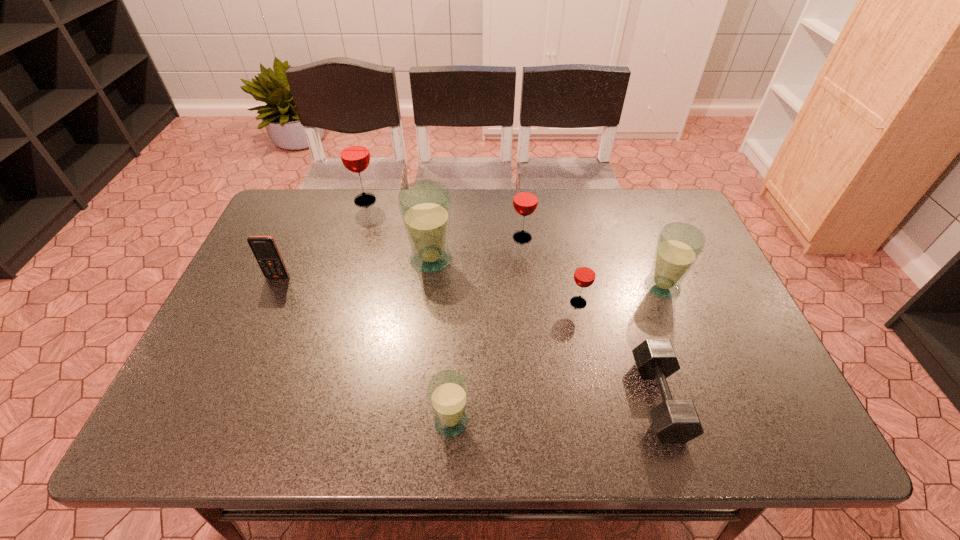
The width and height of the screenshot is (960, 540). What are the coordinates of `the fifth glass from left to right` in the screenshot? It's located at (584, 276).

The width and height of the screenshot is (960, 540). What are the coordinates of `the smallest blue glass` in the screenshot? It's located at (448, 391).

You are a GUI agent. You are given a task and a screenshot of the screen. Output one action in this format:
    pyautogui.click(x=<x>, y=<y>)
    Task: Click on the nearest blue glass
    The width and height of the screenshot is (960, 540).
    Given the screenshot: What is the action you would take?
    pyautogui.click(x=448, y=391)

Where is `the second object from right to left`? This screenshot has width=960, height=540. the second object from right to left is located at coordinates (674, 421).

Find the location of `dumbbell`. dumbbell is located at coordinates (674, 421).

Where is `vacant space located 0.140m on the right of the leftmost red glass`? vacant space located 0.140m on the right of the leftmost red glass is located at coordinates (421, 200).

Where is `free point located on the front of the biggest blue glass`? free point located on the front of the biggest blue glass is located at coordinates (415, 409).

Where is `vacant space located on the left of the rightmost object`? Image resolution: width=960 pixels, height=540 pixels. vacant space located on the left of the rightmost object is located at coordinates (564, 287).

What are the coordinates of `vacant space located 0.090m on the front of the second farthest red glass` in the screenshot? It's located at (525, 267).

Identify the location of free space located 0.250m on the screen of the orange cellular telephone. This screenshot has height=540, width=960. (243, 357).